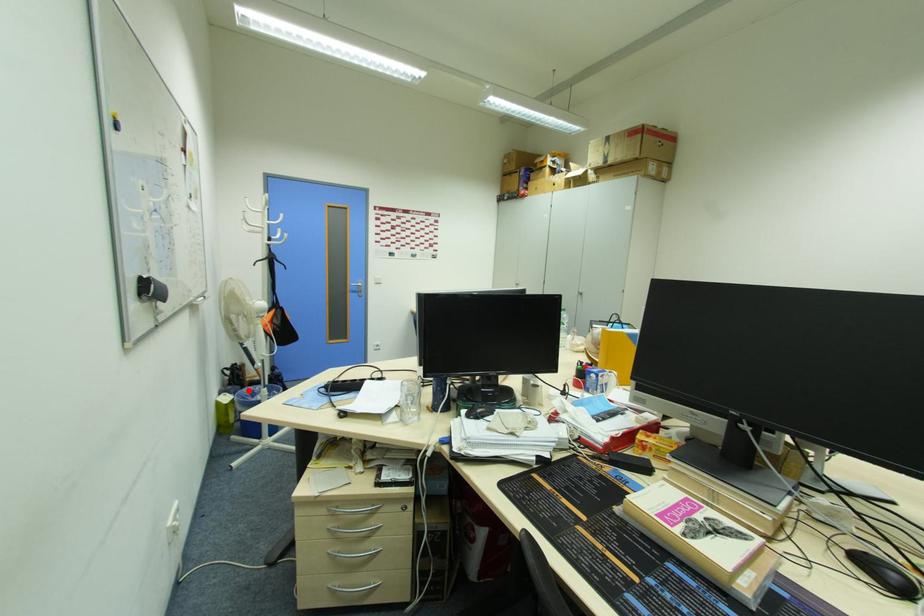
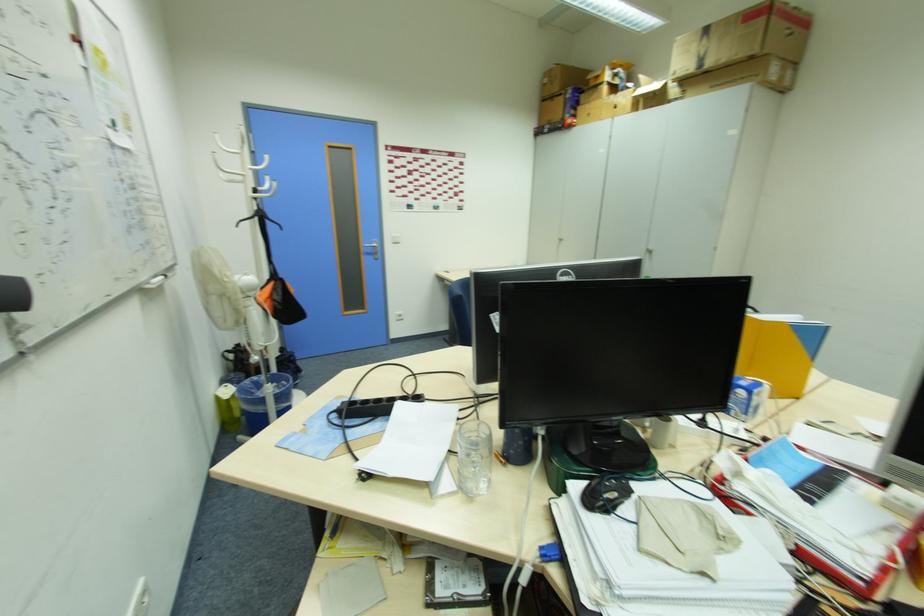
Question: A red point is marked in image1. In image2, is the corresponding 3D point closer to the camera or farther? Reply with the corresponding letter.

Choices:
 (A) The corresponding 3D point is closer.
 (B) The corresponding 3D point is farther.

Answer: (B)